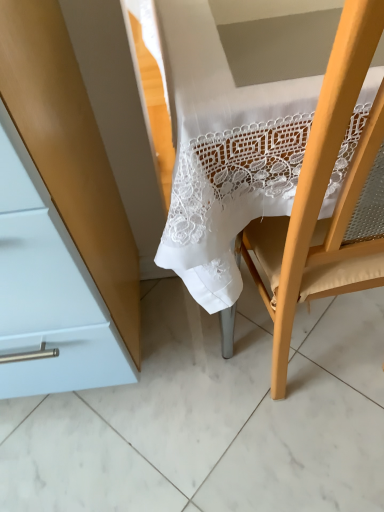
Image resolution: width=384 pixels, height=512 pixels. What do you see at coordinates (323, 189) in the screenshot?
I see `wooden chair at right` at bounding box center [323, 189].

In order to click on wooden chair at right in this screenshot , I will do `click(323, 189)`.

Measure the distance between wooden chair at right and camera.

A distance of 12.64 inches exists between wooden chair at right and camera.

Where is `wooden chair at right`? wooden chair at right is located at coordinates (323, 189).